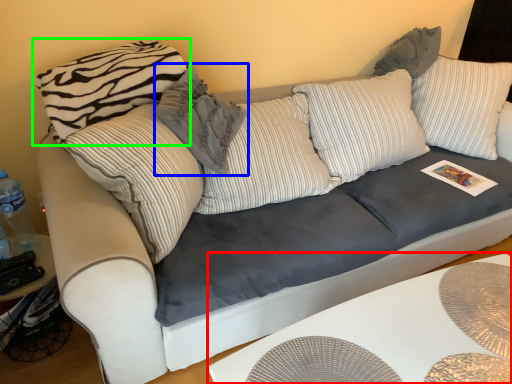
Question: Considering the real-world distances, which object is farthest from table (highlighted by a red box)? pillow (highlighted by a blue box) or pillow (highlighted by a green box)?

Choices:
 (A) pillow
 (B) pillow

Answer: (B)